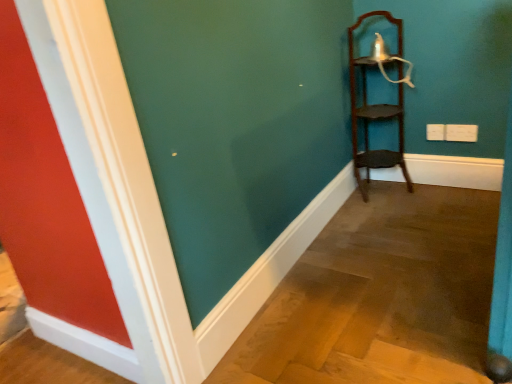
The height and width of the screenshot is (384, 512). What are the coordinates of `vacant area situated below dark wood shelf at upper right (from a real-world perspective)` in the screenshot? It's located at (382, 182).